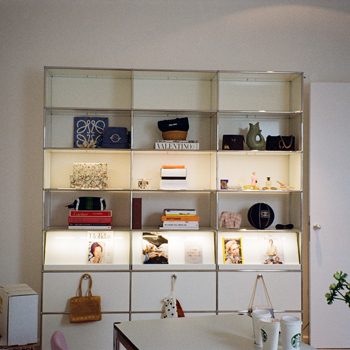
Identify the location of cup lid. (295, 322).